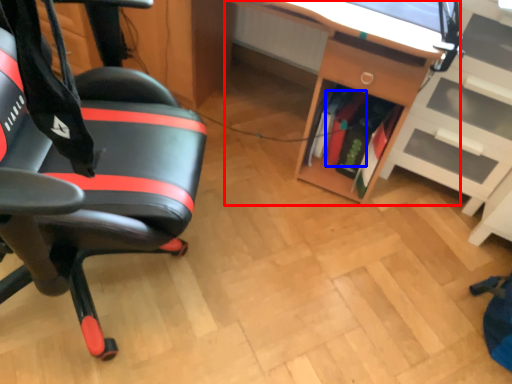
Question: Which point is closer to the camera, desk (highlighted by a red box) or book (highlighted by a blue box)?

Choices:
 (A) desk
 (B) book

Answer: (A)